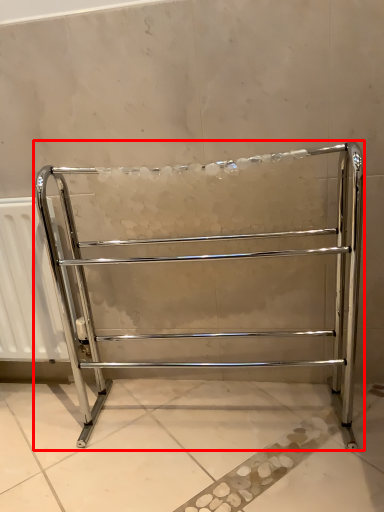
Question: In this image, where is furniture (annotated by the red box) located relative to radiator?

Choices:
 (A) left
 (B) right

Answer: (B)